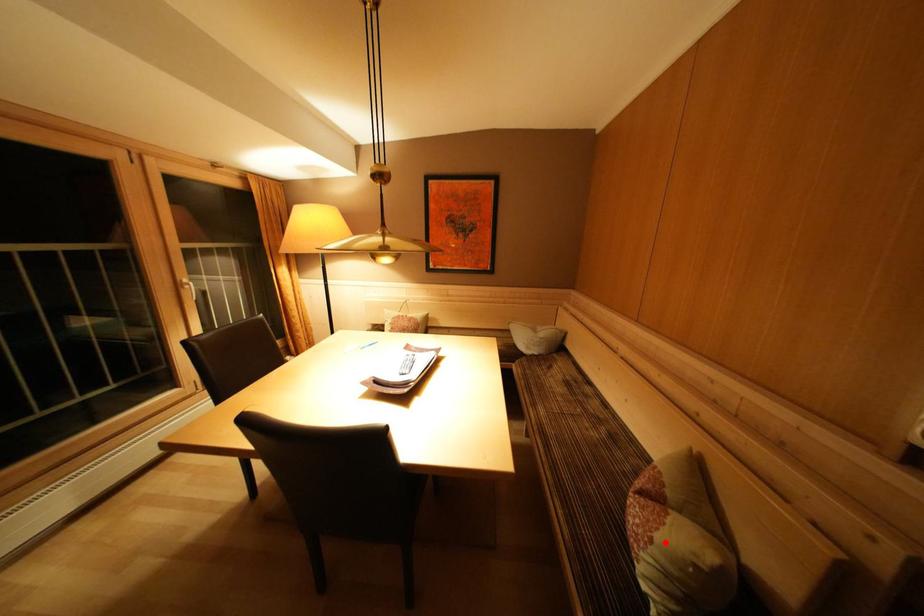
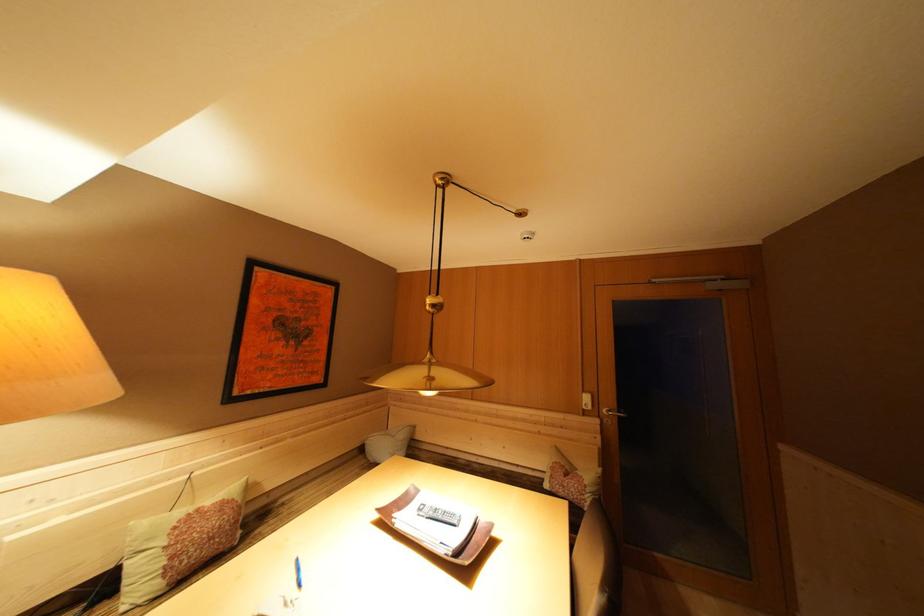
Question: I am providing you with two images of the same scene from different viewpoints. Given a red point in image1, look at the same physical point in image2. Is it:

Choices:
 (A) Closer to the viewpoint
 (B) Farther from the viewpoint

Answer: (B)